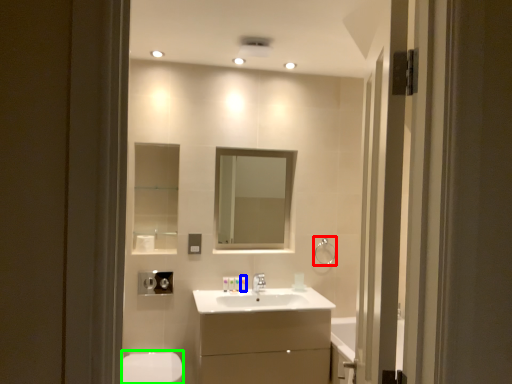
Question: Which is nearer to the towel bar (highlighted by a red box)? toiletry (highlighted by a blue box) or toilet bowl (highlighted by a green box).

Choices:
 (A) toiletry
 (B) toilet bowl

Answer: (A)